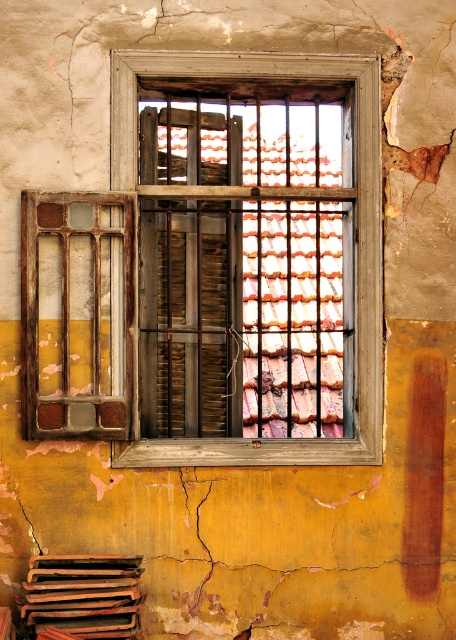
You are a painter standing in front of the weathered yellow wall with the window. You have two points marked on the wall at coordinates point (x=372, y=275) and point (x=112, y=396). Which point should you paint first if you want to start with the one closer to you?

You should paint point (x=112, y=396) first because it is closer to you than point (x=372, y=275), which is further away.

You are standing in front of a wall with a wooden frame at center and a rusty metal shutter at left. Which object is positioned to the right side?

The wooden frame at center is positioned to the right of the rusty metal shutter at left.

You are a painter assessing the wall for a restoration project. You notice the wooden frame at center and the rusty metal shutter at left. Which object has a greater width when viewed from your current position?

The wooden frame at center might be wider than the rusty metal shutter at left according to the description provided.